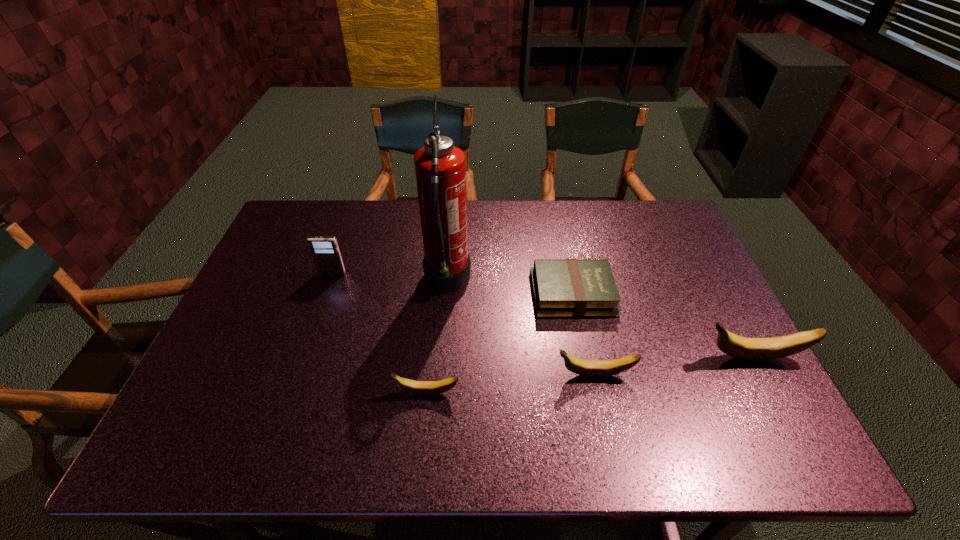
In the current image, all bananas are evenly spaced. To maintain this equal spacing, where should an additional banana be placed on the left? Please point out a free spot. Please provide its 2D coordinates. Your answer should be formatted as a tuple, i.e. [(x, y)], where the tuple contains the x and y coordinates of a point satisfying the conditions above.

[(247, 412)]